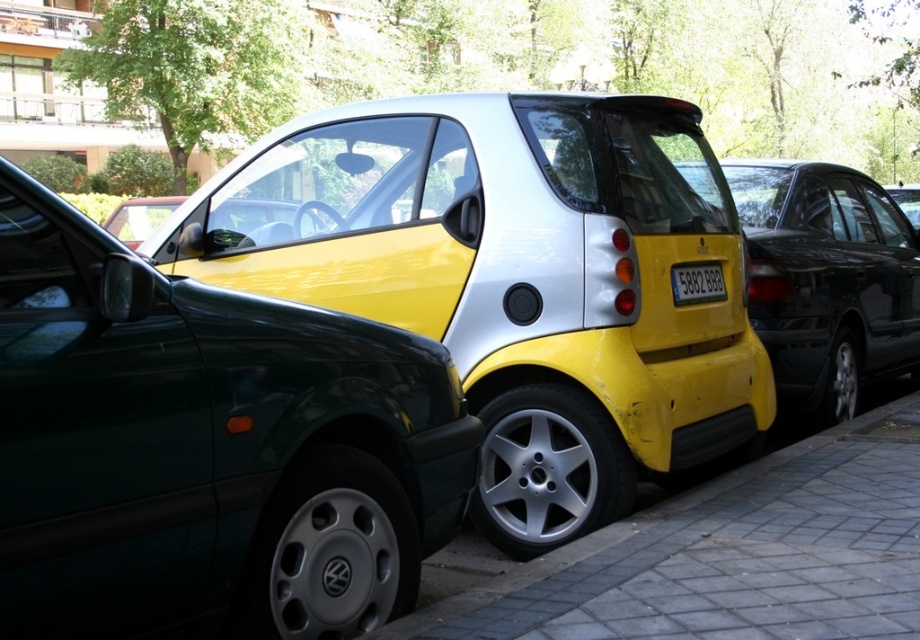
From the picture: Does metallic green car at left have a greater height compared to black plastic license plate at rear?

Indeed, metallic green car at left has a greater height compared to black plastic license plate at rear.

Can you confirm if metallic green car at left is shorter than black plastic license plate at rear?

No, metallic green car at left is not shorter than black plastic license plate at rear.

This screenshot has width=920, height=640. I want to click on metallic green car at left, so click(207, 449).

Locate an element on the screen. The image size is (920, 640). metallic green car at left is located at coordinates (207, 449).

Does yellow matte/silver smart car at center have a lesser height compared to black plastic license plate at rear?

In fact, yellow matte/silver smart car at center may be taller than black plastic license plate at rear.

Looking at this image, who is higher up, yellow matte/silver smart car at center or black plastic license plate at rear?

yellow matte/silver smart car at center is higher up.

Identify the location of yellow matte/silver smart car at center. (828, 280).

Where is `yellow matte/silver smart car at center`? yellow matte/silver smart car at center is located at coordinates (828, 280).

Can you confirm if yellow matte/silver car at center is taller than metallic green car at left?

Yes, yellow matte/silver car at center is taller than metallic green car at left.

Does point (667, 301) come farther from viewer compared to point (320, 563)?

Yes.

Locate an element on the screen. yellow matte/silver car at center is located at coordinates (512, 278).